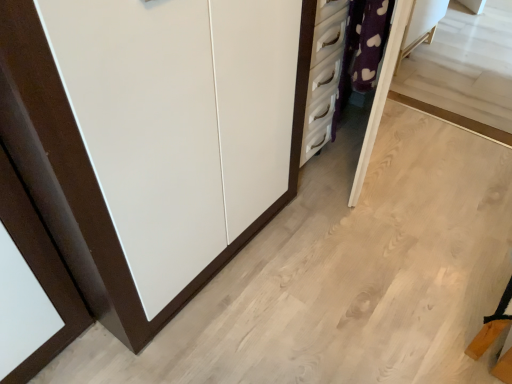
Question: Does white matte cupboard at left turn towards purple fabric vanity at upper right?

Choices:
 (A) no
 (B) yes

Answer: (A)

Question: Can you confirm if white matte cupboard at left is positioned to the left of purple fabric vanity at upper right?

Choices:
 (A) yes
 (B) no

Answer: (A)

Question: From the image's perspective, does white matte cupboard at left appear lower than purple fabric vanity at upper right?

Choices:
 (A) yes
 (B) no

Answer: (A)

Question: From a real-world perspective, is white matte cupboard at left located beneath purple fabric vanity at upper right?

Choices:
 (A) no
 (B) yes

Answer: (B)

Question: From the image's perspective, does white matte cupboard at left appear higher than purple fabric vanity at upper right?

Choices:
 (A) yes
 (B) no

Answer: (B)

Question: Is white matte cupboard at left not close to purple fabric vanity at upper right?

Choices:
 (A) yes
 (B) no

Answer: (A)

Question: Considering the relative sizes of purple fabric vanity at upper right and white matte cupboard at left in the image provided, is purple fabric vanity at upper right thinner than white matte cupboard at left?

Choices:
 (A) yes
 (B) no

Answer: (A)

Question: Is purple fabric vanity at upper right positioned far away from white matte cupboard at left?

Choices:
 (A) no
 (B) yes

Answer: (B)

Question: Are purple fabric vanity at upper right and white matte cupboard at left making contact?

Choices:
 (A) yes
 (B) no

Answer: (B)

Question: Is purple fabric vanity at upper right positioned before white matte cupboard at left?

Choices:
 (A) yes
 (B) no

Answer: (B)

Question: Considering the relative sizes of purple fabric vanity at upper right and white matte cupboard at left in the image provided, is purple fabric vanity at upper right bigger than white matte cupboard at left?

Choices:
 (A) yes
 (B) no

Answer: (B)

Question: From the image's perspective, is purple fabric vanity at upper right beneath white matte cupboard at left?

Choices:
 (A) no
 (B) yes

Answer: (A)

Question: Looking at their shapes, would you say white matte cupboard at left is wider or thinner than purple fabric vanity at upper right?

Choices:
 (A) thin
 (B) wide

Answer: (B)